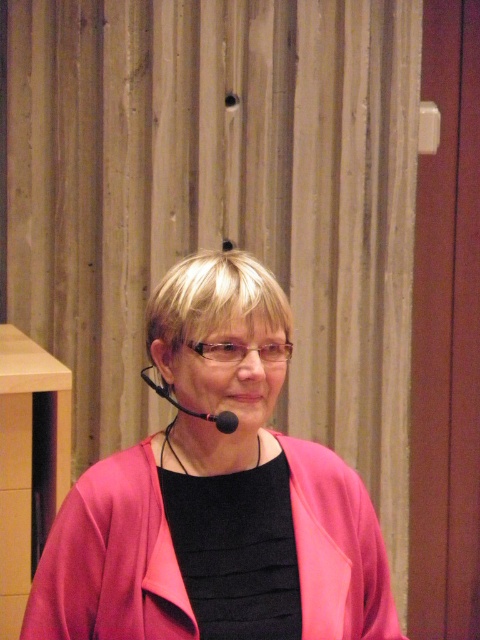
Does pink matte jacket at center have a smaller size compared to wooden stool at left?

Correct, pink matte jacket at center occupies less space than wooden stool at left.

Can you confirm if pink matte jacket at center is wider than wooden stool at left?

Yes.

Where is `pink matte jacket at center`? This screenshot has height=640, width=480. pink matte jacket at center is located at coordinates (216, 496).